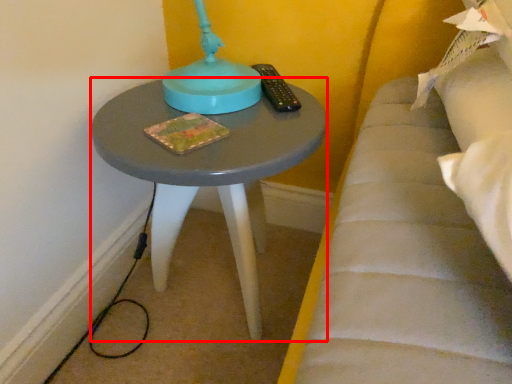
Question: From the image's perspective, what is the correct spatial positioning of table (annotated by the red box) in reference to remote?

Choices:
 (A) below
 (B) above

Answer: (A)